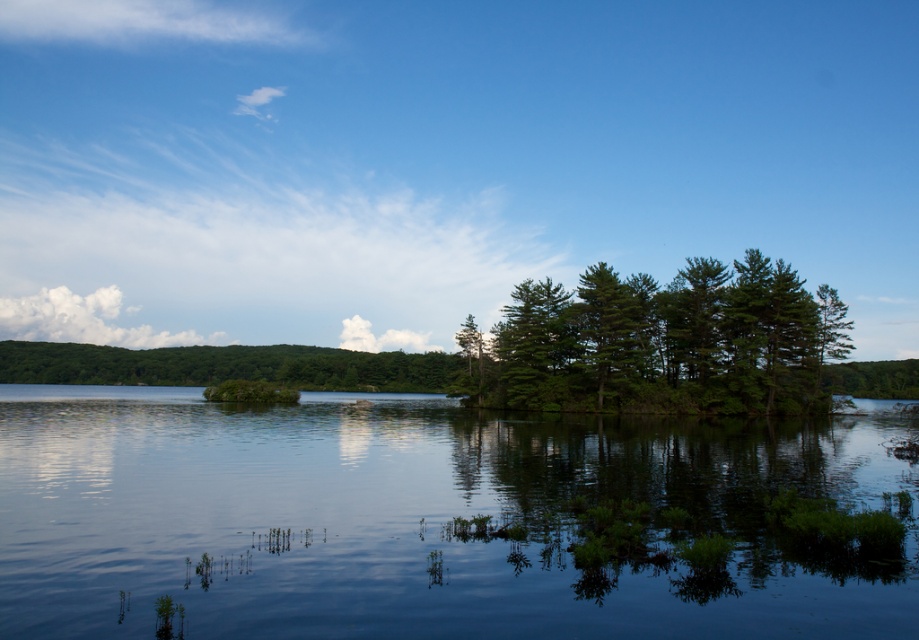
Question: Which of the following is the closest to the observer?

Choices:
 (A) (445, 628)
 (B) (230, 353)
 (C) (790, 387)

Answer: (A)

Question: Is green matte trees at center to the right of green matte tree at center from the viewer's perspective?

Choices:
 (A) no
 (B) yes

Answer: (B)

Question: Does green matte trees at center have a smaller size compared to green matte tree at center?

Choices:
 (A) no
 (B) yes

Answer: (B)

Question: Does transparent blue water at center have a smaller size compared to green matte tree at center?

Choices:
 (A) no
 (B) yes

Answer: (B)

Question: Which object is farther from the camera taking this photo?

Choices:
 (A) green matte trees at center
 (B) transparent blue water at center
 (C) green matte tree at center

Answer: (C)

Question: Based on their relative distances, which object is farther from the green matte trees at center?

Choices:
 (A) green matte tree at center
 (B) transparent blue water at center

Answer: (A)